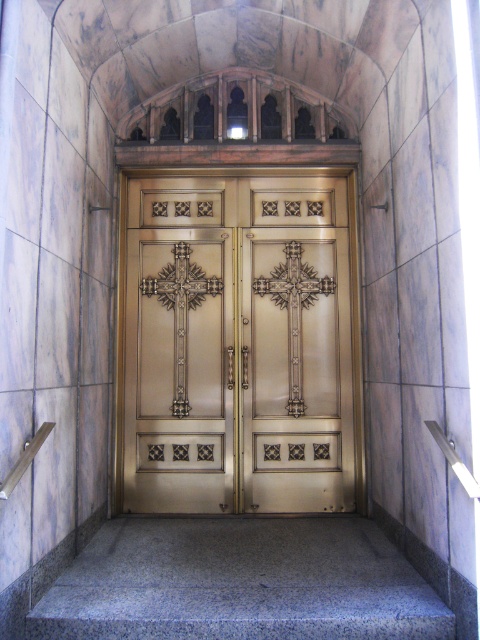
Looking at this image, you are a delivery person trying to determine the best place to set a heavy box. You see the gold polished metal doors at center and the granite at center. Which surface is suitable for placing the box?

The granite at center is suitable for placing the box since the gold polished metal doors at center are above it and likely not designed to hold heavy items.

Looking at this image, you are an interior designer planning to install a new door frame that requires a 10 cm thickness. Given the gold polished metal doors at center and the granite at center in the scene, which material would you recommend for the frame to ensure it can be securely attached without compromising structural integrity?

The granite at center is thicker than the gold polished metal doors at center, so the granite at center would be more suitable for securely attaching the door frame as it provides a stronger and thicker base.

Based on the photo, you are an interior designer planning to install a new floor in the entrance. The gold polished metal doors at center and the granite at center are existing elements. Which element takes up more space in the entrance?

The gold polished metal doors at center is bigger than granite at center, so it takes up more space in the entrance.